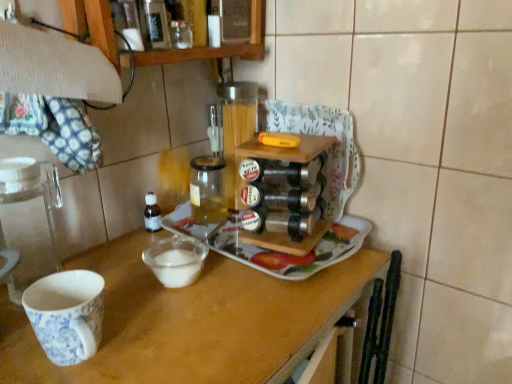
The width and height of the screenshot is (512, 384). I want to click on vacant area that is in front of white ceramic tray at center, so click(220, 316).